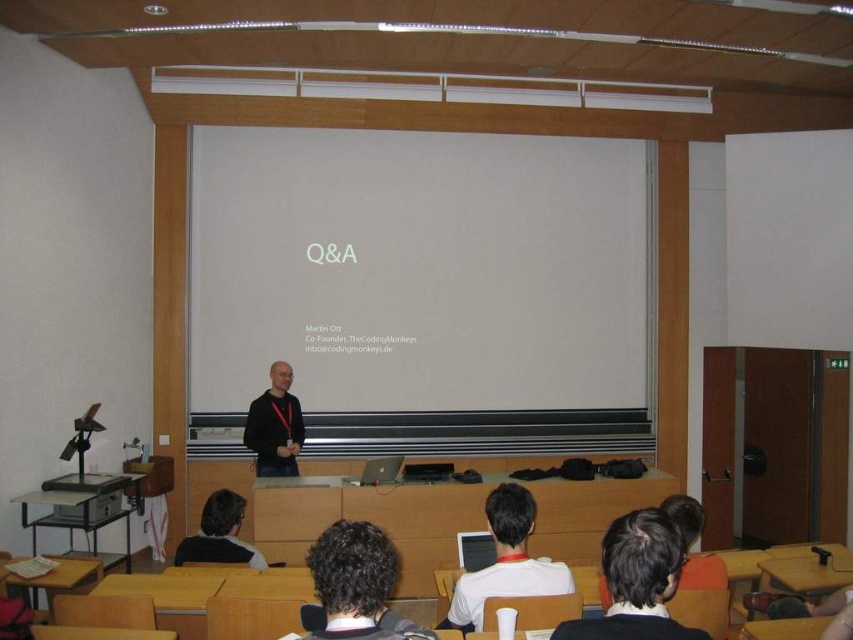
Question: Is white matte projection screen at center bigger than black matte shirt at center?

Choices:
 (A) no
 (B) yes

Answer: (B)

Question: Which point appears closest to the camera in this image?

Choices:
 (A) (606, 444)
 (B) (234, 545)
 (C) (271, 372)

Answer: (B)

Question: Estimate the real-world distances between objects in this image. Which object is closer to the white matte projection screen at center?

Choices:
 (A) white matte laptop at lower center
 (B) dark brown hair at lower center

Answer: (B)

Question: Does white matte projection screen at center have a greater width compared to dark brown hair at lower center?

Choices:
 (A) yes
 (B) no

Answer: (A)

Question: Among these objects, which one is farthest from the camera?

Choices:
 (A) dark brown hair at lower center
 (B) black matte shirt at center
 (C) white matte projection screen at center

Answer: (C)

Question: Is white matte laptop at lower center above black matte shirt at center?

Choices:
 (A) no
 (B) yes

Answer: (A)